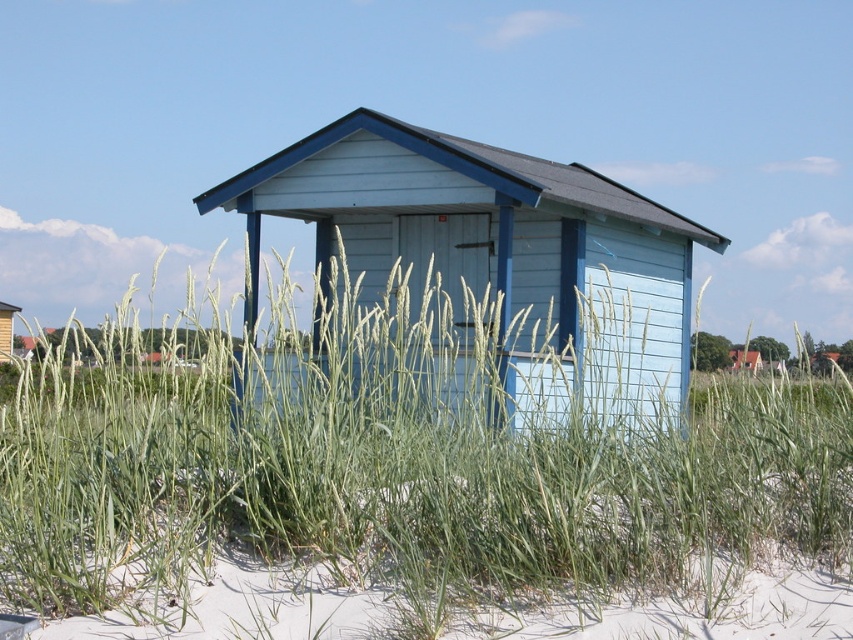
Question: Does light blue wood cabin at center have a larger size compared to matte blue wooden hut at center?

Choices:
 (A) yes
 (B) no

Answer: (B)

Question: Does green grass at center have a smaller size compared to matte blue wooden hut at center?

Choices:
 (A) yes
 (B) no

Answer: (A)

Question: Which point appears farthest from the camera in this image?

Choices:
 (A) (12, 308)
 (B) (96, 413)
 (C) (479, 288)

Answer: (A)

Question: Is light blue wood cabin at center further to the viewer compared to matte blue wooden hut at center?

Choices:
 (A) no
 (B) yes

Answer: (A)

Question: Which point is farther to the camera?

Choices:
 (A) light blue wood cabin at center
 (B) matte blue wooden hut at center
 (C) green grass at center

Answer: (B)

Question: Among these points, which one is nearest to the camera?

Choices:
 (A) (581, 579)
 (B) (9, 324)

Answer: (A)